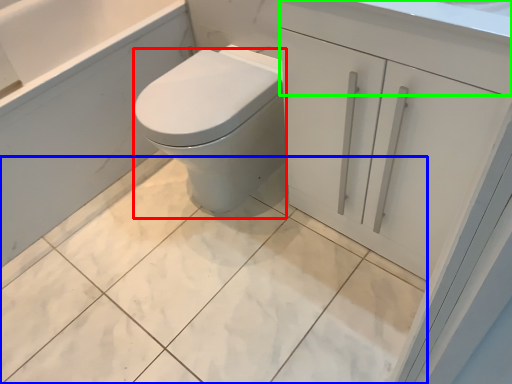
Question: Which object is positioned farthest from bidet (highlighted by a red box)? Select from ceramic tile (highlighted by a blue box) and drawer (highlighted by a green box).

Choices:
 (A) ceramic tile
 (B) drawer

Answer: (B)